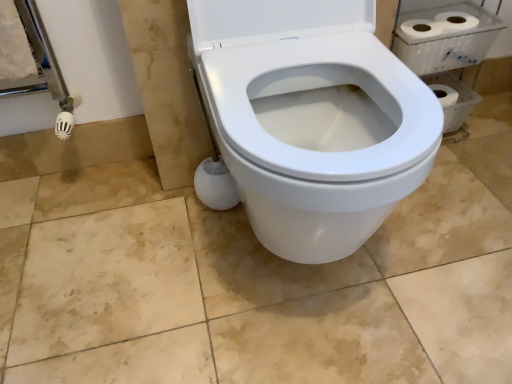
Find the location of a particular element. The width and height of the screenshot is (512, 384). vacant area situated below white glossy toilet at center (from a real-world perspective) is located at coordinates (302, 284).